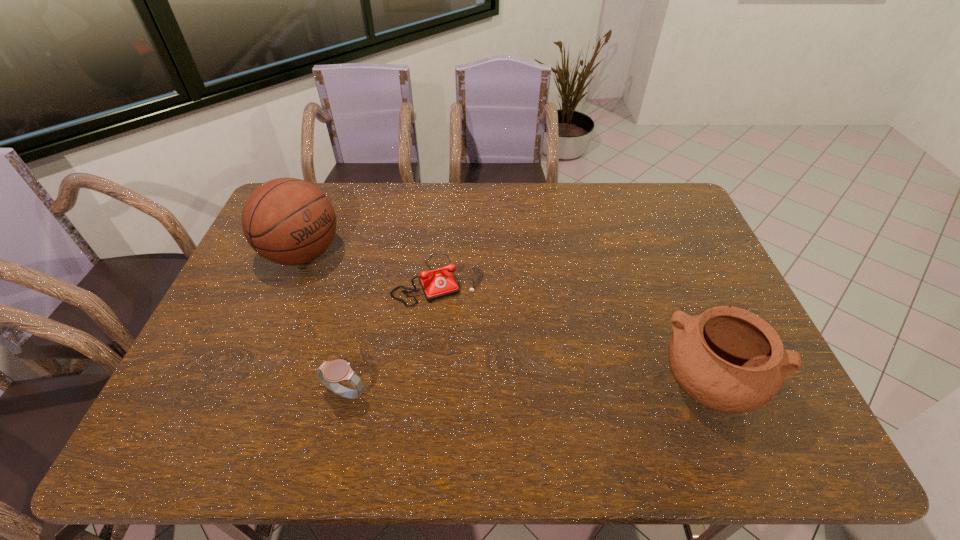
You are a GUI agent. You are given a task and a screenshot of the screen. Output one action in this format:
    pyautogui.click(x=<x>, y=<y>)
    Task: Click on the empty space that is in between the rightmost object and the leftmost object
    This screenshot has height=540, width=960.
    Given the screenshot: What is the action you would take?
    pyautogui.click(x=507, y=319)

I want to click on vacant area that lies between the second shortest object and the telephone, so click(x=392, y=336).

You are a GUI agent. You are given a task and a screenshot of the screen. Output one action in this format:
    pyautogui.click(x=<x>, y=<y>)
    Task: Click on the unoccupied position between the basketball and the shortest object
    This screenshot has width=960, height=540.
    Given the screenshot: What is the action you would take?
    click(x=371, y=267)

This screenshot has width=960, height=540. I want to click on empty space between the second object from right to left and the watch, so click(392, 336).

Find the location of a particular element. The height and width of the screenshot is (540, 960). object that is the third closest one to the second shortest object is located at coordinates (728, 359).

Locate which object ranks in proximity to the telephone. Please provide its 2D coordinates. Your answer should be formatted as a tuple, i.e. [(x, y)], where the tuple contains the x and y coordinates of a point satisfying the conditions above.

[(288, 221)]

The width and height of the screenshot is (960, 540). I want to click on blank area in the image that satisfies the following two spatial constraints: 1. on the front side of the leftmost object; 2. on the right side of the watch, so click(246, 393).

Where is `vacant space that satisfies the following two spatial constraints: 1. on the front side of the rightmost object; 2. on the right side of the tallest object`? The image size is (960, 540). vacant space that satisfies the following two spatial constraints: 1. on the front side of the rightmost object; 2. on the right side of the tallest object is located at coordinates click(250, 385).

Find the location of a particular element. This screenshot has height=540, width=960. free space that satisfies the following two spatial constraints: 1. on the front side of the second tallest object; 2. on the left side of the leftmost object is located at coordinates (250, 385).

Identify the location of vacant space that satisfies the following two spatial constraints: 1. on the front side of the pottery; 2. on the right side of the shortest object. (428, 385).